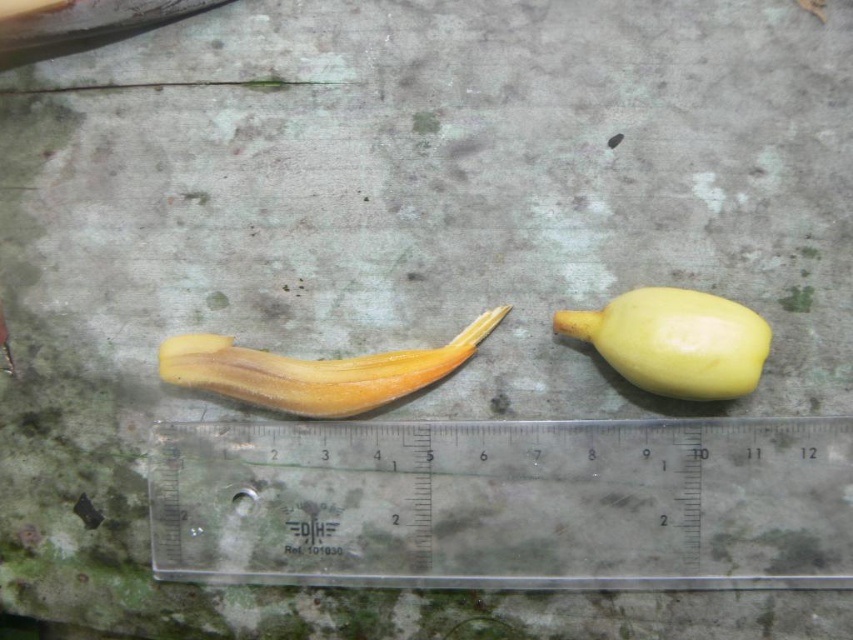
Is transparent plastic ruler at center to the right of yellow matte fruit at right from the viewer's perspective?

Incorrect, transparent plastic ruler at center is not on the right side of yellow matte fruit at right.

Locate an element on the screen. The width and height of the screenshot is (853, 640). transparent plastic ruler at center is located at coordinates (506, 502).

Which is behind, point (697, 468) or point (277, 356)?

Point (277, 356)

How distant is transparent plastic ruler at center from yellow matte banana at center?

They are 7.08 inches apart.

Where is `transparent plastic ruler at center`? transparent plastic ruler at center is located at coordinates (506, 502).

Locate an element on the screen. The image size is (853, 640). transparent plastic ruler at center is located at coordinates (506, 502).

Who is more forward, (x=637, y=316) or (x=368, y=392)?

Point (x=637, y=316) is in front.

Locate an element on the screen. The height and width of the screenshot is (640, 853). yellow matte fruit at right is located at coordinates (675, 340).

Identify the location of yellow matte fruit at right. The height and width of the screenshot is (640, 853). (675, 340).